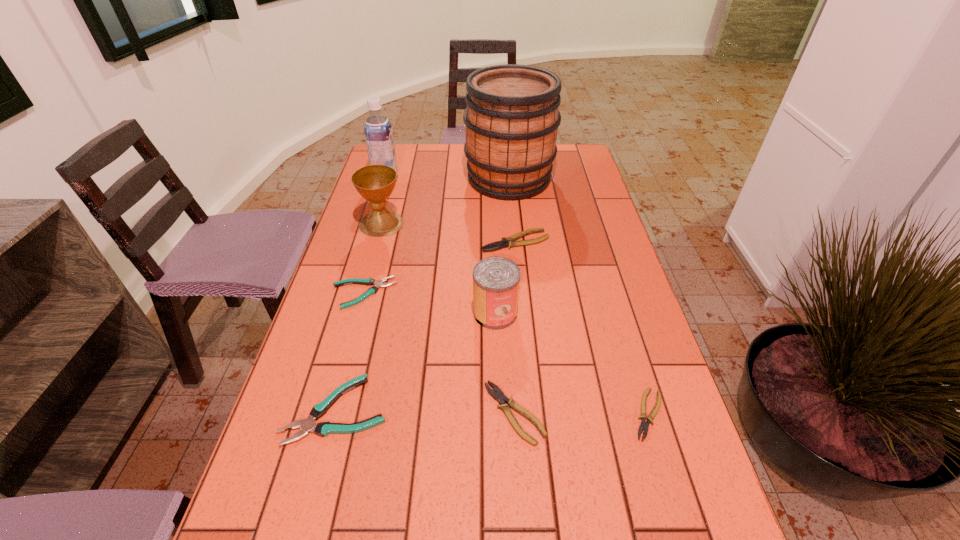
Find the location of a particular element. This screenshot has height=540, width=960. cider is located at coordinates (512, 118).

At what (x,y) coordinates should I click in order to perform the action: click on the second tallest object. Please return your answer as a coordinate pair (x, y). Looking at the image, I should click on pyautogui.click(x=378, y=132).

Where is `brown chalice`? The height and width of the screenshot is (540, 960). brown chalice is located at coordinates (375, 183).

At what (x,y) coordinates should I click in order to perform the action: click on the seventh shortest object. Please return your answer as a coordinate pair (x, y). Looking at the image, I should click on (375, 183).

At what (x,y) coordinates should I click in order to perform the action: click on the fourth tallest object. Please return your answer as a coordinate pair (x, y). Looking at the image, I should click on (496, 280).

Where is `the farthest yellow pliers`? The image size is (960, 540). the farthest yellow pliers is located at coordinates (509, 242).

Locate an element on the screen. Image resolution: width=960 pixels, height=540 pixels. the biggest yellow pliers is located at coordinates (509, 242).

Locate an element on the screen. This screenshot has width=960, height=540. the bigger teal pliers is located at coordinates (323, 429).

Where is `the second biggest yellow pliers`? the second biggest yellow pliers is located at coordinates (499, 396).

In order to click on the smaller teal pliers in this screenshot , I will do `click(372, 290)`.